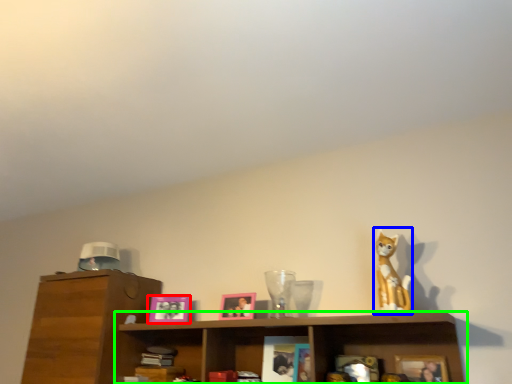
Question: Which object is positioned closest to picture frame (highlighted by a red box)? Select from toy (highlighted by a blue box) and shelf (highlighted by a green box).

Choices:
 (A) toy
 (B) shelf

Answer: (B)